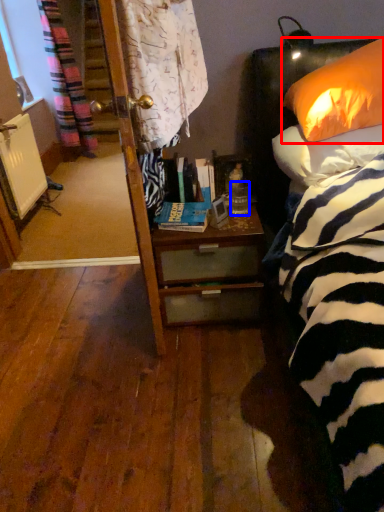
Question: Which of the following is the farthest to the observer, pillow (highlighted by a red box) or coffee cup (highlighted by a blue box)?

Choices:
 (A) pillow
 (B) coffee cup

Answer: (B)